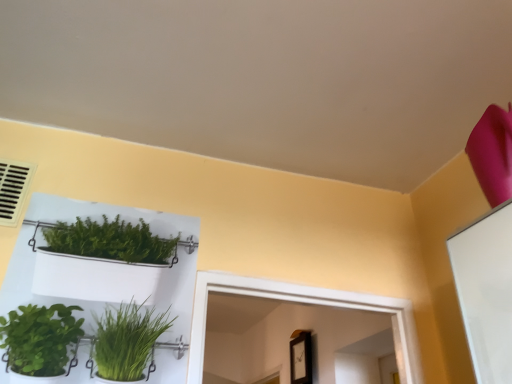
Describe the element at coordinates (13, 190) in the screenshot. I see `beige plastic air conditioning at upper left` at that location.

This screenshot has height=384, width=512. Identify the location of beige plastic air conditioning at upper left. (13, 190).

Find the location of a particular element. This screenshot has height=384, width=512. white plastic shelf at upper left is located at coordinates (97, 293).

The image size is (512, 384). What do you see at coordinates (97, 293) in the screenshot?
I see `white plastic shelf at upper left` at bounding box center [97, 293].

This screenshot has height=384, width=512. In order to click on beige plastic air conditioning at upper left in this screenshot , I will do `click(13, 190)`.

Is white plastic shelf at upper left to the right of beige plastic air conditioning at upper left from the viewer's perspective?

Yes.

Considering their positions, is white plastic shelf at upper left located in front of or behind beige plastic air conditioning at upper left?

white plastic shelf at upper left is in front of beige plastic air conditioning at upper left.

Is point (155, 336) more distant than point (17, 177)?

No.

From the image's perspective, is white plastic shelf at upper left under beige plastic air conditioning at upper left?

Yes.

From a real-world perspective, relative to beige plastic air conditioning at upper left, is white plastic shelf at upper left vertically above or below?

From a real-world perspective, white plastic shelf at upper left is physically below beige plastic air conditioning at upper left.

Does white plastic shelf at upper left have a lesser width compared to beige plastic air conditioning at upper left?

Yes, white plastic shelf at upper left is thinner than beige plastic air conditioning at upper left.

Is white plastic shelf at upper left taller or shorter than beige plastic air conditioning at upper left?

white plastic shelf at upper left is taller than beige plastic air conditioning at upper left.

Between white plastic shelf at upper left and beige plastic air conditioning at upper left, which one has larger size?

With larger size is white plastic shelf at upper left.

Is white plastic shelf at upper left completely or partially outside of beige plastic air conditioning at upper left?

white plastic shelf at upper left is positioned outside beige plastic air conditioning at upper left.

Is white plastic shelf at upper left with beige plastic air conditioning at upper left?

white plastic shelf at upper left and beige plastic air conditioning at upper left are not in contact.

Could you tell me if white plastic shelf at upper left is facing beige plastic air conditioning at upper left?

No, white plastic shelf at upper left is not aimed at beige plastic air conditioning at upper left.

In the scene shown: How different are the orientations of white plastic shelf at upper left and beige plastic air conditioning at upper left in degrees?

The facing directions of white plastic shelf at upper left and beige plastic air conditioning at upper left are 4.41 degrees apart.

How far apart are white plastic shelf at upper left and beige plastic air conditioning at upper left?

white plastic shelf at upper left and beige plastic air conditioning at upper left are 31.82 centimeters apart.

This screenshot has width=512, height=384. I want to click on air conditioning located behind the white plastic shelf at upper left, so click(x=13, y=190).

Which is more to the right, beige plastic air conditioning at upper left or white plastic shelf at upper left?

From the viewer's perspective, white plastic shelf at upper left appears more on the right side.

Consider the image. Does beige plastic air conditioning at upper left lie in front of white plastic shelf at upper left?

No, it is not.

Is point (19, 194) closer or farther from the camera than point (174, 328)?

Point (19, 194).

From the image's perspective, who appears lower, beige plastic air conditioning at upper left or white plastic shelf at upper left?

white plastic shelf at upper left, from the image's perspective.

From a real-world perspective, is beige plastic air conditioning at upper left positioned over white plastic shelf at upper left based on gravity?

Yes, from a real-world perspective, beige plastic air conditioning at upper left is over white plastic shelf at upper left

Which of these two, beige plastic air conditioning at upper left or white plastic shelf at upper left, is thinner?

white plastic shelf at upper left is thinner.

Which of these two, beige plastic air conditioning at upper left or white plastic shelf at upper left, stands taller?

With more height is white plastic shelf at upper left.

Can you confirm if beige plastic air conditioning at upper left is bigger than white plastic shelf at upper left?

Incorrect, beige plastic air conditioning at upper left is not larger than white plastic shelf at upper left.

Which is correct: beige plastic air conditioning at upper left is inside white plastic shelf at upper left, or outside of it?

beige plastic air conditioning at upper left cannot be found inside white plastic shelf at upper left.

Is beige plastic air conditioning at upper left far from white plastic shelf at upper left?

No.

Is beige plastic air conditioning at upper left facing towards white plastic shelf at upper left?

No.

How different are the orientations of beige plastic air conditioning at upper left and white plastic shelf at upper left in degrees?

The angular difference between beige plastic air conditioning at upper left and white plastic shelf at upper left is 4.41 degrees.

Identify the location of shelf that appears on the right of beige plastic air conditioning at upper left. The width and height of the screenshot is (512, 384). (97, 293).

Where is `air conditioning above the white plastic shelf at upper left (from the image's perspective)`? This screenshot has height=384, width=512. air conditioning above the white plastic shelf at upper left (from the image's perspective) is located at coordinates (13, 190).

Image resolution: width=512 pixels, height=384 pixels. I want to click on air conditioning positioned vertically above the white plastic shelf at upper left (from a real-world perspective), so click(x=13, y=190).